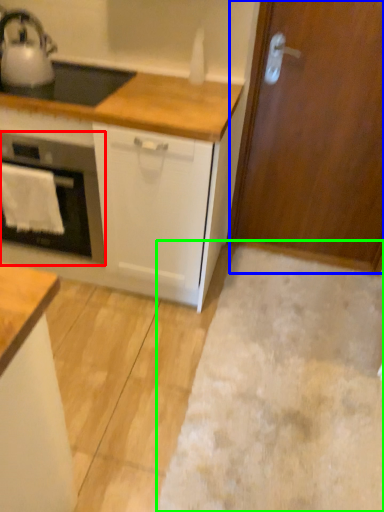
Question: Based on their relative distances, which object is nearer to home appliance (highlighted by a red box)? Choose from door (highlighted by a blue box) and plain (highlighted by a green box).

Choices:
 (A) door
 (B) plain

Answer: (B)